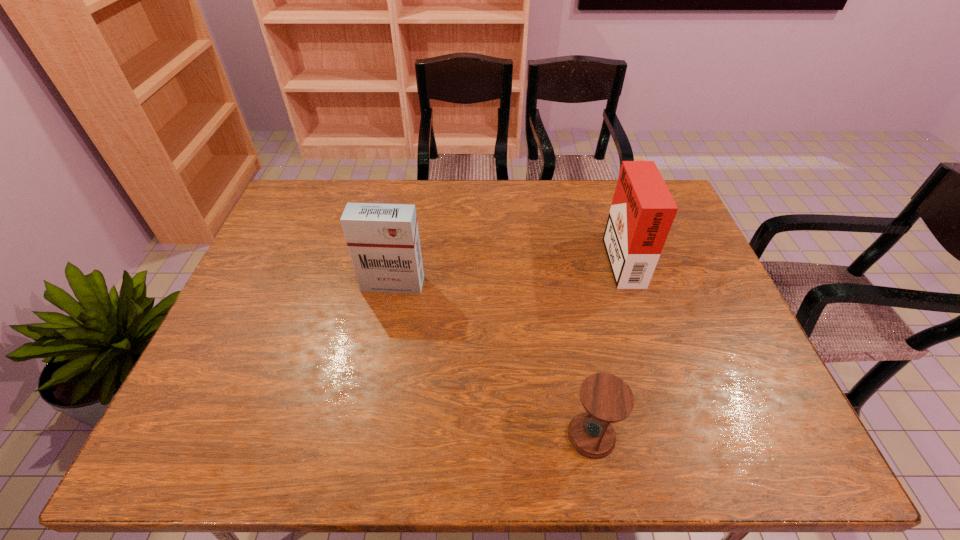
Locate an element on the screen. Image resolution: width=960 pixels, height=540 pixels. vacant space at the far edge is located at coordinates click(571, 212).

This screenshot has width=960, height=540. I want to click on free point at the near edge, so click(635, 453).

Identify the location of free region at the left edge of the desktop. tap(272, 355).

In the image, there is a desktop. Identify the location of vacant region at the right edge. (692, 255).

The height and width of the screenshot is (540, 960). In the image, there is a desktop. Identify the location of vacant space at the far left corner. (317, 181).

The width and height of the screenshot is (960, 540). I want to click on vacant space in between the hourglass and the leftmost object, so click(492, 360).

Locate an element on the screen. The width and height of the screenshot is (960, 540). empty location between the left cigarette case and the nearest object is located at coordinates (492, 360).

What are the coordinates of `vacant area that lies between the left cigarette case and the right cigarette case` in the screenshot? It's located at (507, 270).

This screenshot has height=540, width=960. I want to click on free area in between the shortest object and the right cigarette case, so click(607, 346).

Identify the location of free area in between the right cigarette case and the leftmost object. The width and height of the screenshot is (960, 540). (507, 270).